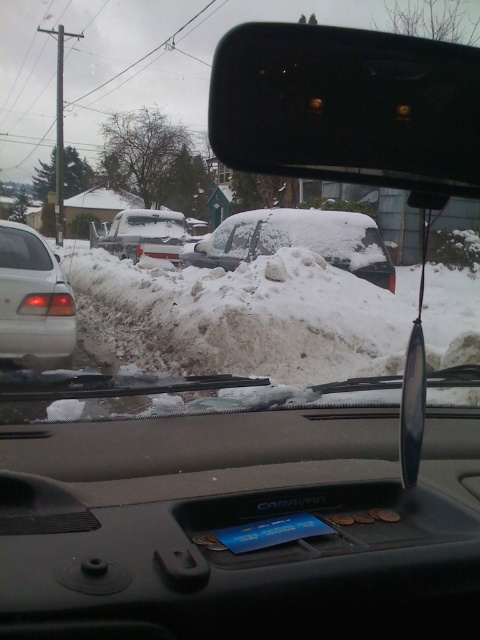
Question: Which object is farther from the camera taking this photo?

Choices:
 (A) matte white car window at left
 (B) white matte car at center
 (C) black plastic dashboard at center

Answer: (B)

Question: Can you confirm if black plastic dashboard at center is smaller than white matte car at center?

Choices:
 (A) yes
 (B) no

Answer: (A)

Question: Can you confirm if black plastic rearview mirror at upper center is wider than snow-covered car at center?

Choices:
 (A) no
 (B) yes

Answer: (A)

Question: Is black plastic rearview mirror at upper center in front of black plastic mirror at center?

Choices:
 (A) no
 (B) yes

Answer: (B)

Question: Estimate the real-world distances between objects in this image. Which object is farther from the black plastic rearview mirror at upper center?

Choices:
 (A) snow-covered car at center
 (B) matte white car window at left

Answer: (A)

Question: Which of the following is the farthest from the observer?

Choices:
 (A) snow-covered car at center
 (B) black plastic mirror at center
 (C) black plastic dashboard at center
 (D) satin silver sedan at left

Answer: (A)